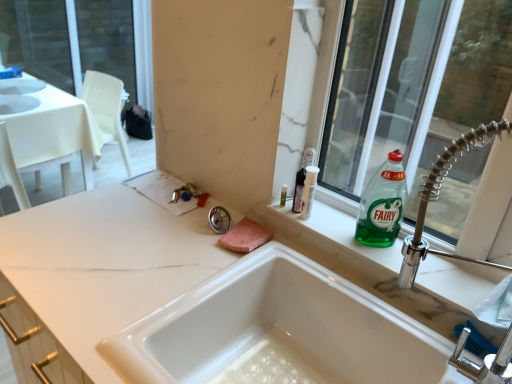
Image resolution: width=512 pixels, height=384 pixels. I want to click on free space to the left of green glass bottle at upper right, so click(322, 226).